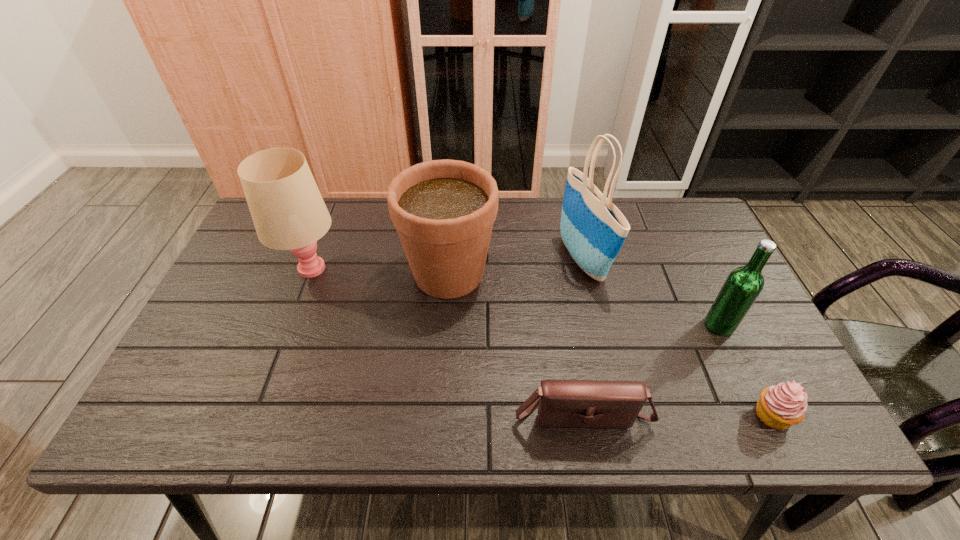
The width and height of the screenshot is (960, 540). In order to click on vacant position in the image that satisfies the following two spatial constraints: 1. on the front side of the fourth farthest object; 2. on the right side of the cupcake in this screenshot , I will do `click(761, 415)`.

The width and height of the screenshot is (960, 540). I want to click on vacant space that satisfies the following two spatial constraints: 1. on the front side of the cupcake; 2. on the right side of the tote bag, so click(617, 415).